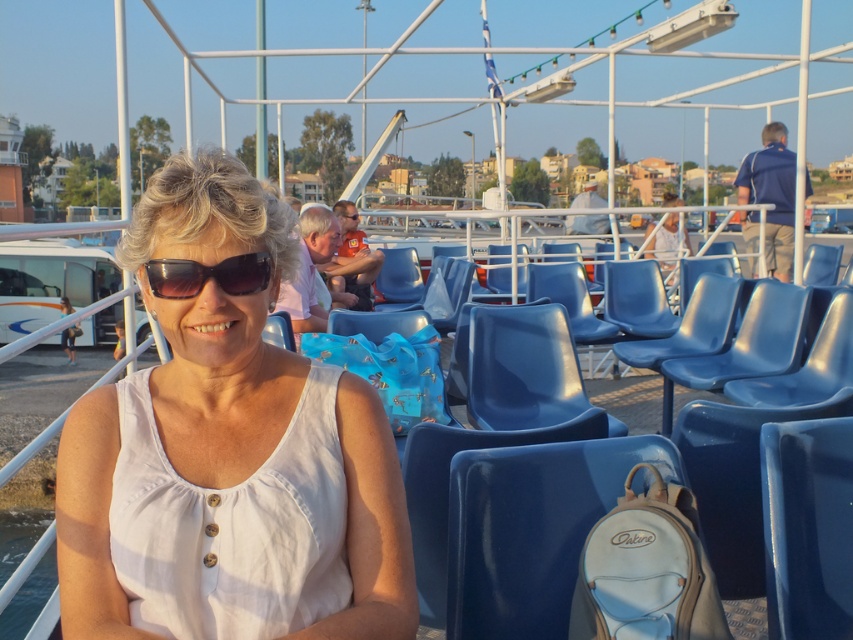
Can you confirm if white cotton tank top at center is positioned to the left of black plastic sunglasses at center?

Indeed, white cotton tank top at center is positioned on the left side of black plastic sunglasses at center.

Is white cotton tank top at center bigger than black plastic sunglasses at center?

Yes, white cotton tank top at center is bigger than black plastic sunglasses at center.

Who is more distant from viewer, (259,316) or (157,284)?

Positioned behind is point (259,316).

I want to click on white cotton tank top at center, so click(228, 456).

The width and height of the screenshot is (853, 640). What do you see at coordinates (207, 275) in the screenshot?
I see `black plastic sunglasses at center` at bounding box center [207, 275].

Identify the location of black plastic sunglasses at center. The height and width of the screenshot is (640, 853). (207, 275).

Is point (183, 244) positioned in front of point (485, 458)?

Yes, it is.

Between white cotton tank top at center and white leather backpack at lower center, which one has more height?

white cotton tank top at center is taller.

The width and height of the screenshot is (853, 640). What do you see at coordinates (228, 456) in the screenshot?
I see `white cotton tank top at center` at bounding box center [228, 456].

Locate an element on the screen. white cotton tank top at center is located at coordinates (228, 456).